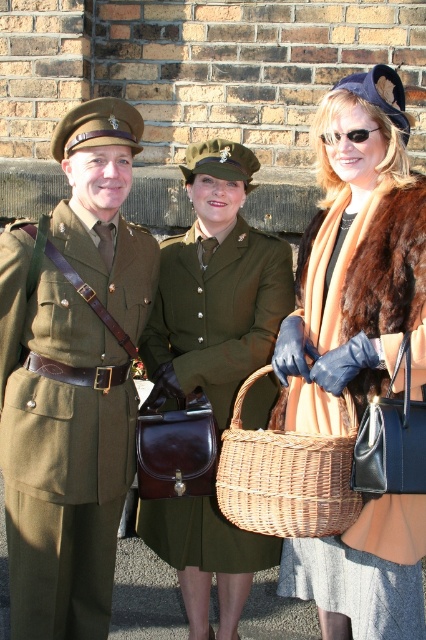
What are the coordinates of the olive green fabric uniform at center?

The olive green fabric uniform at center is located at coordinates point (218, 310).

Based on the scene description, which object is positioned to the left of the other? The olive green fabric uniform at center or the woven brown basket at center?

The olive green fabric uniform at center is to the left of the woven brown basket at center according to the description.

Looking at this image, you are standing in front of the brick wall and want to place a small flag exactly halfway between point (x=85, y=625) and point (x=376, y=164). Considering their positions relative to you, will the flag be closer to the wall or to you?

The flag placed halfway between point (x=85, y=625) and point (x=376, y=164) will be closer to the wall because point (x=376, y=164) is farther away from the viewer, so the midpoint leans towards it, making the flag closer to the wall.